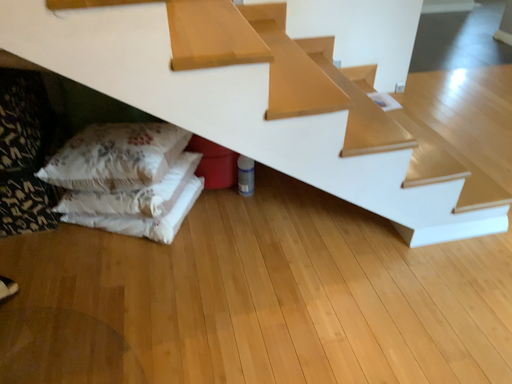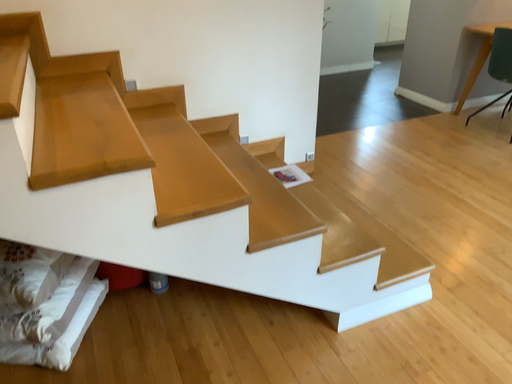
Question: Which way did the camera rotate in the video?

Choices:
 (A) rotated downward
 (B) rotated upward

Answer: (B)